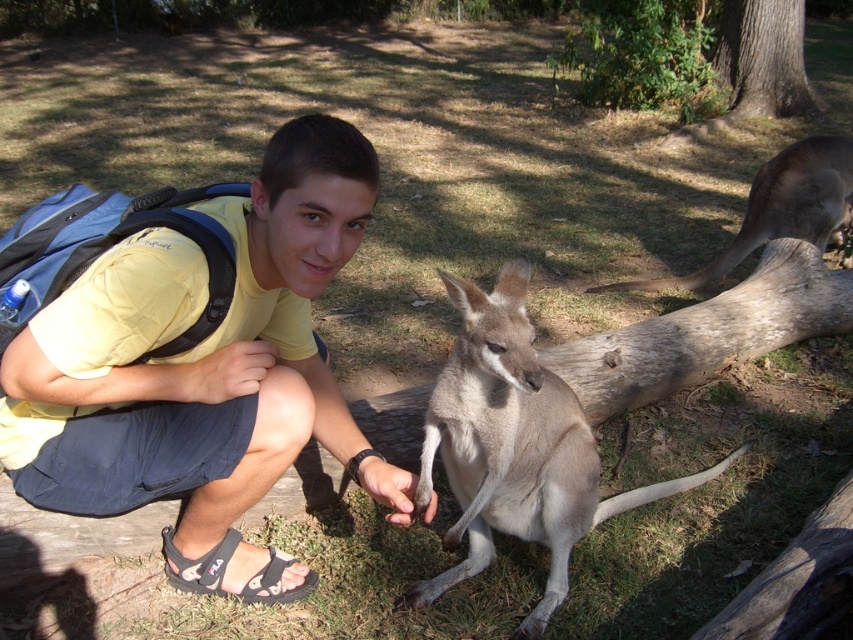
You are a photographer trying to capture a candid shot of the yellow fabric shirt at center and brown fur at right. The camera you are using has a maximum focus range of 10 feet. Will you be able to capture both subjects in focus at the same time?

The yellow fabric shirt at center and brown fur at right are 10.10 feet apart from each other. Since the camera has a maximum focus range of 10 feet, the distance between them exceeds this limit. Therefore, you cannot capture both subjects in focus simultaneously.

You are taking a photo of the kangaroo and the person. The kangaroo is at point [514,632] and the person is at point [206,428]. Which point is closer to the camera?

Point [206,428] is closer to the camera than point [514,632].